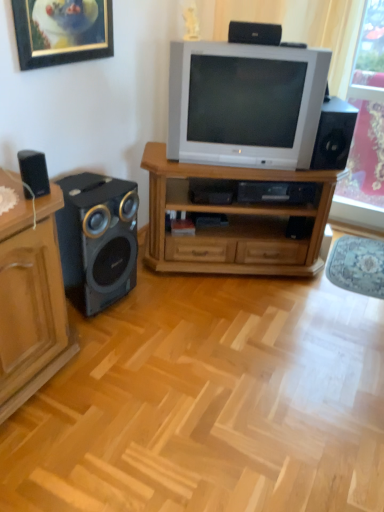
This screenshot has width=384, height=512. I want to click on free space in front of matte wood cabinet at left, so click(46, 455).